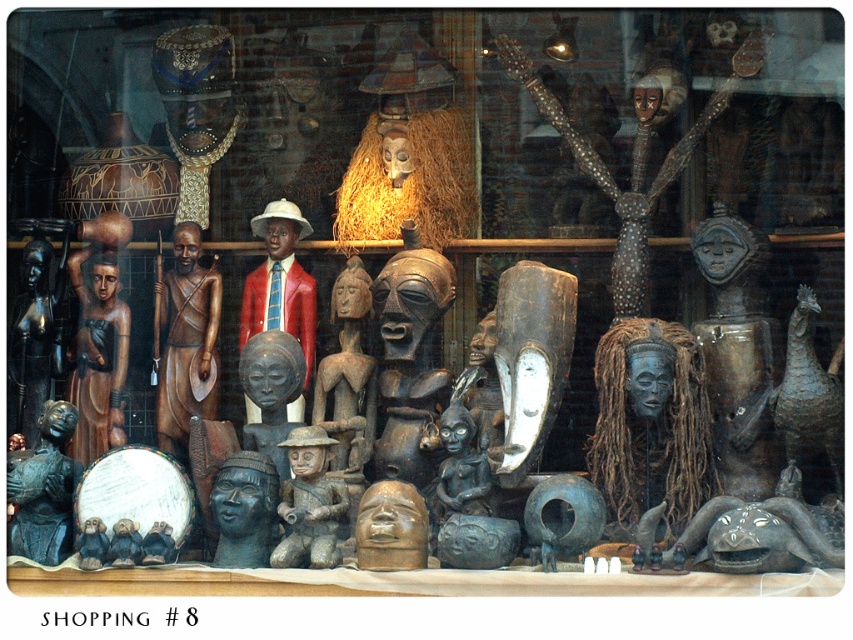
Is wooden mask at center further to the viewer compared to brown wood figure at center?

Yes, it is behind brown wood figure at center.

The image size is (853, 640). What do you see at coordinates (633, 156) in the screenshot?
I see `wooden mask at center` at bounding box center [633, 156].

What do you see at coordinates (633, 156) in the screenshot? I see `wooden mask at center` at bounding box center [633, 156].

The image size is (853, 640). In order to click on wooden mask at center in this screenshot , I will do `click(633, 156)`.